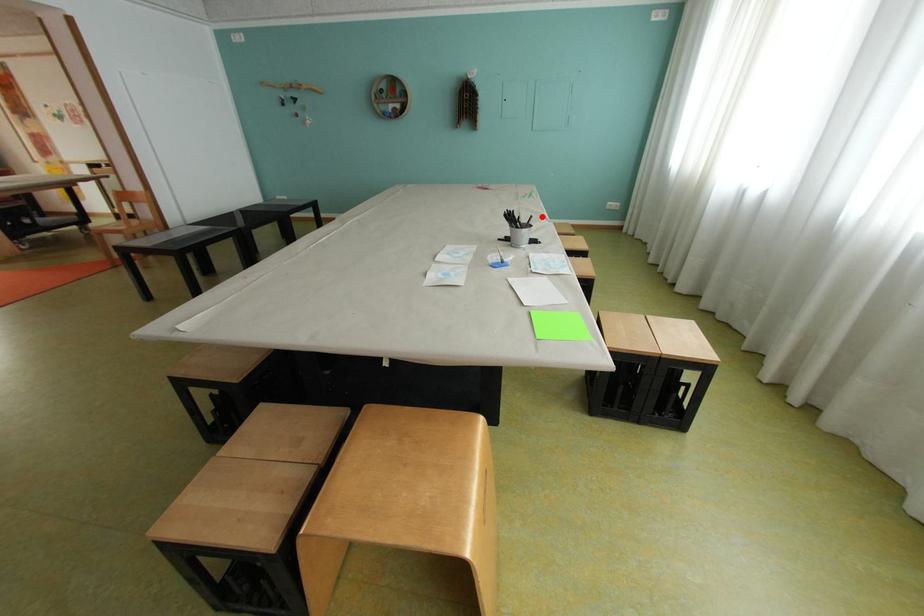
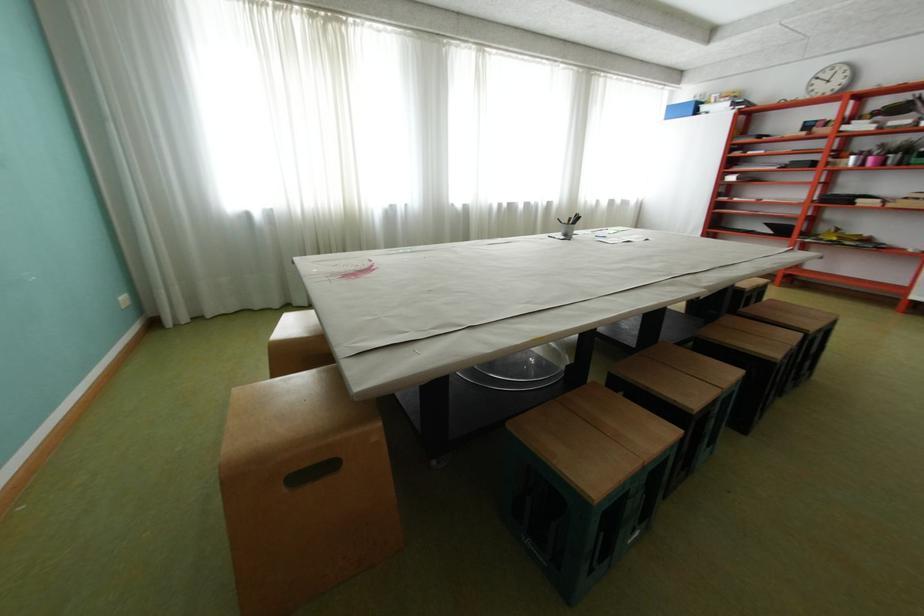
Where in the second image is the point corresponding to the highlighted location from the first image?

(568, 219)